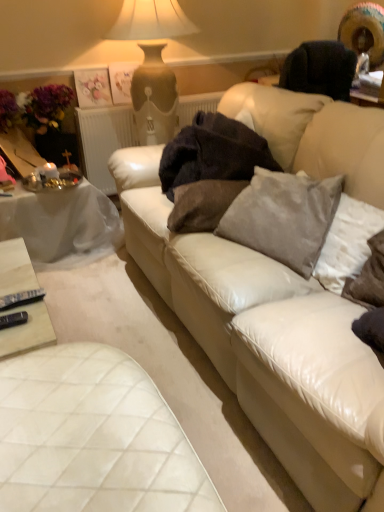
Question: Visually, is white textured radiator at upper center positioned to the left or to the right of white leather couch at center?

Choices:
 (A) left
 (B) right

Answer: (A)

Question: In the image, is white textured radiator at upper center positioned in front of or behind white leather couch at center?

Choices:
 (A) behind
 (B) front

Answer: (A)

Question: Which is farther from the white leather couch at center?

Choices:
 (A) white quilted leather table at lower left, which is the second table in back-to-front order
 (B) velvet gray pillow at center, placed as the 1th pillow when sorted from left to right
 (C) white textured radiator at upper center
 (D) gray velvety pillow at right, the third pillow positioned from the left
 (E) white cloth-covered table at left, placed as the 1th table when sorted from back to front

Answer: (C)

Question: Which object is the farthest from the gray velvet pillow at center, the second pillow viewed from the left?

Choices:
 (A) white textured radiator at upper center
 (B) white quilted leather table at lower left, placed as the 1th table when sorted from bottom to top
 (C) velvet gray pillow at center, placed as the 3th pillow when sorted from right to left
 (D) gray velvety pillow at right, the third pillow positioned from the left
 (E) dark woolen blanket at center

Answer: (A)